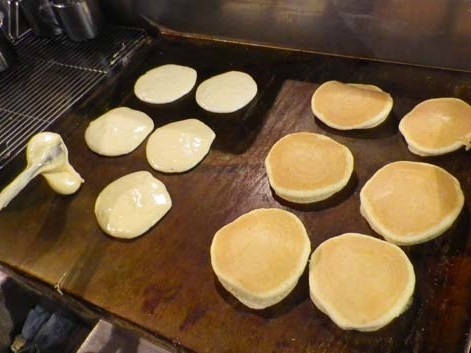
What are the coordinates of `grate` in the screenshot? It's located at (60, 112).